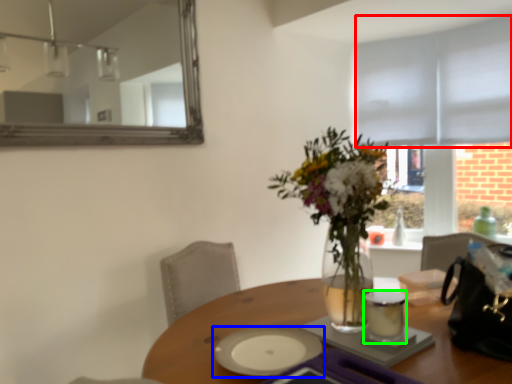
Question: Which is farther away from blind (highlighted by a red box)? tableware (highlighted by a blue box) or tableware (highlighted by a green box)?

Choices:
 (A) tableware
 (B) tableware

Answer: (A)